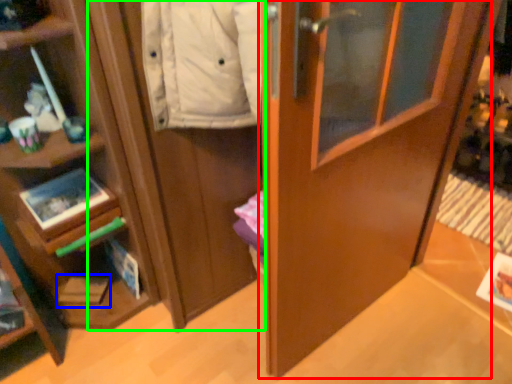
Question: Based on their relative distances, which object is farther from door (highlighted by a red box)? Choose from magazine (highlighted by a blue box) and cabinetry (highlighted by a green box).

Choices:
 (A) magazine
 (B) cabinetry

Answer: (A)